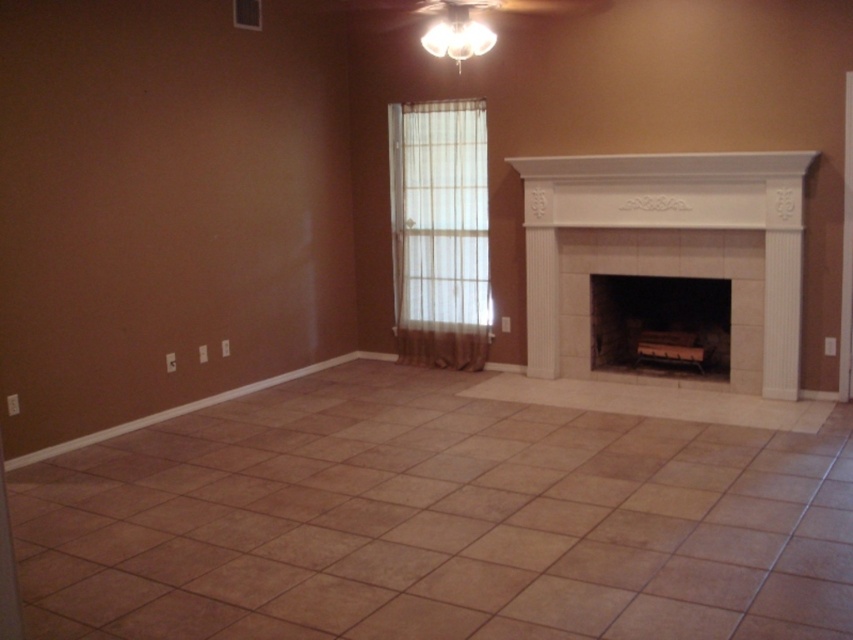
In the scene shown: Is white tile fireplace at center closer to camera compared to sheer white curtain at center?

Yes.

Can you confirm if white tile fireplace at center is positioned above sheer white curtain at center?

Incorrect, white tile fireplace at center is not positioned above sheer white curtain at center.

Where is `white tile fireplace at center`? The width and height of the screenshot is (853, 640). white tile fireplace at center is located at coordinates (668, 236).

Locate an element on the screen. This screenshot has height=640, width=853. white tile fireplace at center is located at coordinates tap(668, 236).

Which is more to the left, sheer white curtain at center or white stone fireplace at center?

sheer white curtain at center

Can you confirm if sheer white curtain at center is wider than white stone fireplace at center?

In fact, sheer white curtain at center might be narrower than white stone fireplace at center.

Which is behind, point (485, 310) or point (688, 323)?

Point (485, 310)

Where is `sheer white curtain at center`? The image size is (853, 640). sheer white curtain at center is located at coordinates (439, 216).

Looking at this image, between white tile fireplace at center and white stone fireplace at center, which one is positioned lower?

white stone fireplace at center is below.

Which is in front, point (798, 230) or point (624, 355)?

Point (798, 230) is more forward.

The height and width of the screenshot is (640, 853). Find the location of `white tile fireplace at center`. white tile fireplace at center is located at coordinates (668, 236).